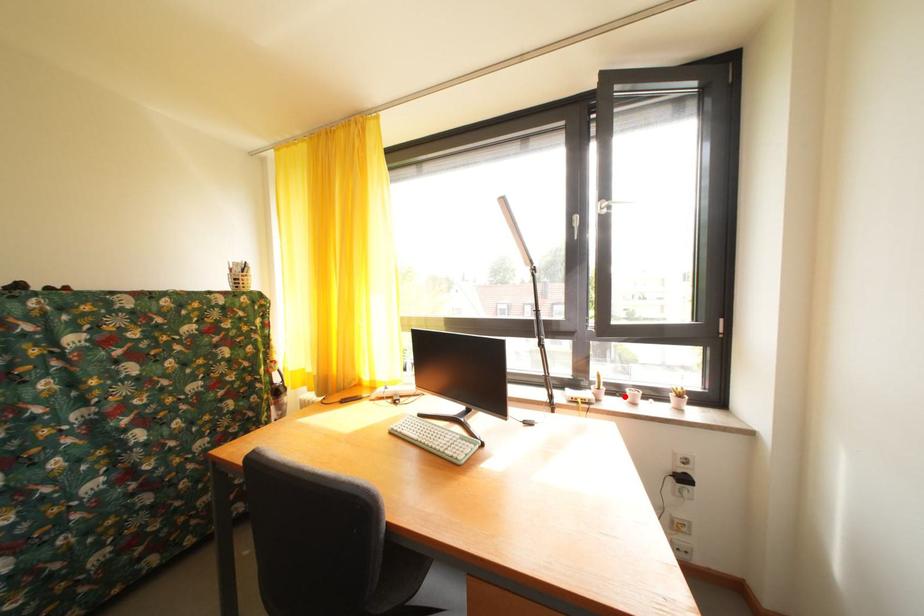
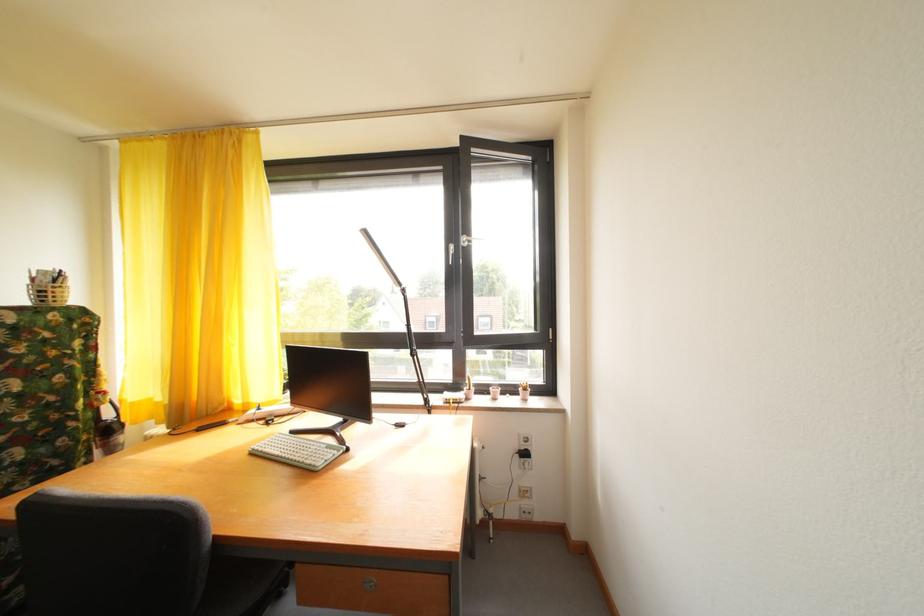
The point at the highlighted location is marked in the first image. Where is the corresponding point in the second image?

(492, 395)